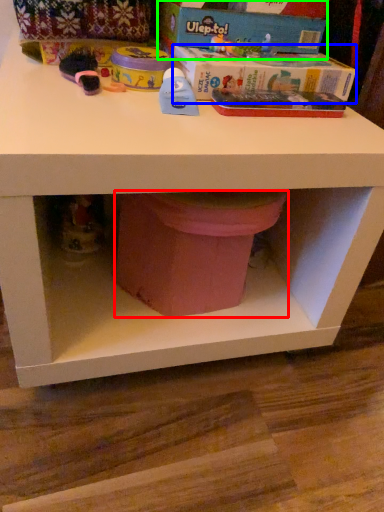
Question: Considering the real-world distances, which object is closest to potty (highlighted by a red box)? box (highlighted by a blue box) or box (highlighted by a green box).

Choices:
 (A) box
 (B) box

Answer: (A)